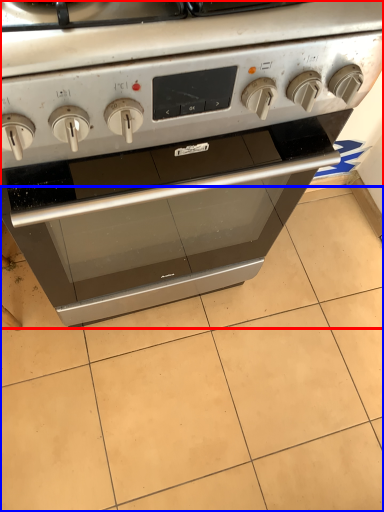
Question: Which of the following is the farthest to the observer, oven (highlighted by a red box) or tile (highlighted by a blue box)?

Choices:
 (A) oven
 (B) tile

Answer: (B)